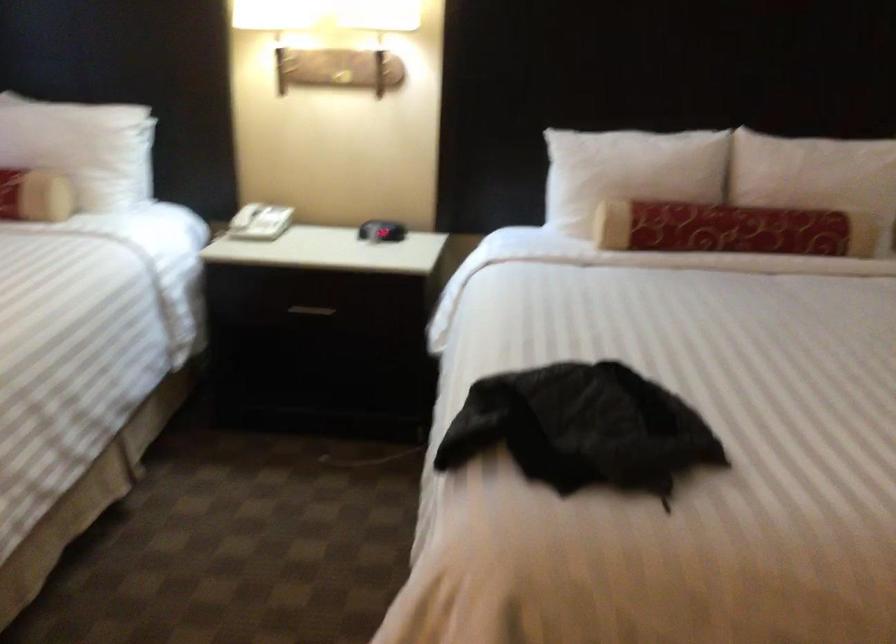
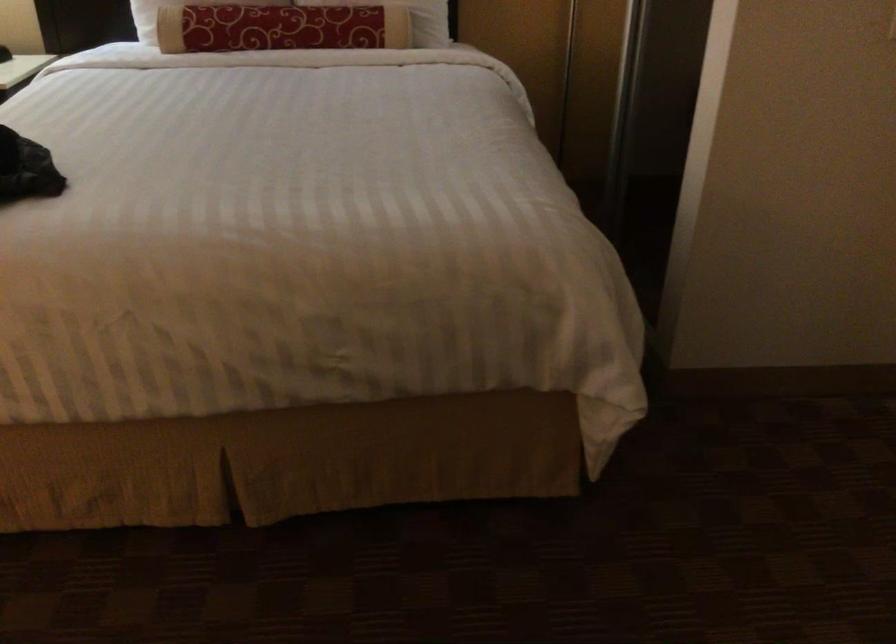
Find the pixel in the second image that matches point 739,223 in the first image.

(280, 28)